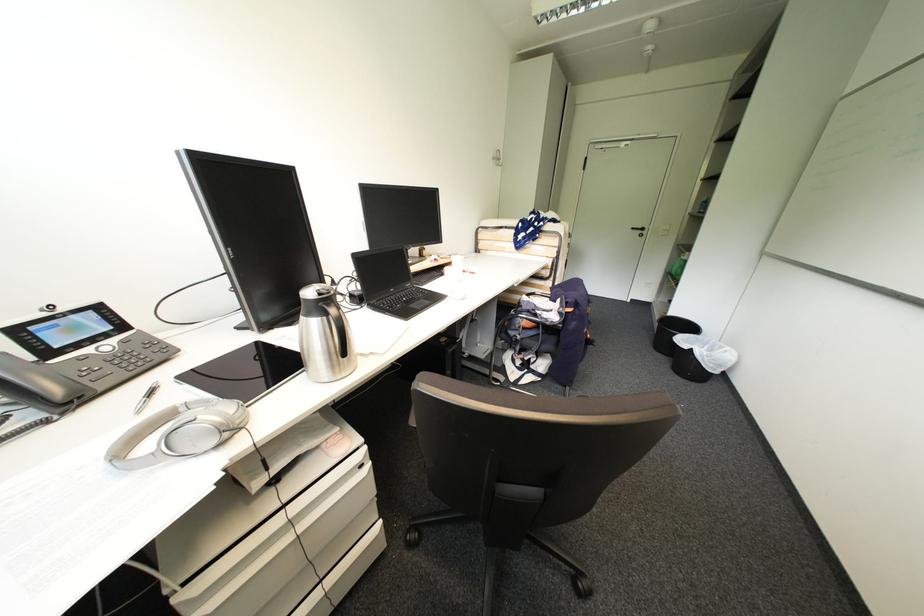
Find where to lift the white ceramic cup. Please return your answer as a coordinate pair (x, y).

(456, 267)